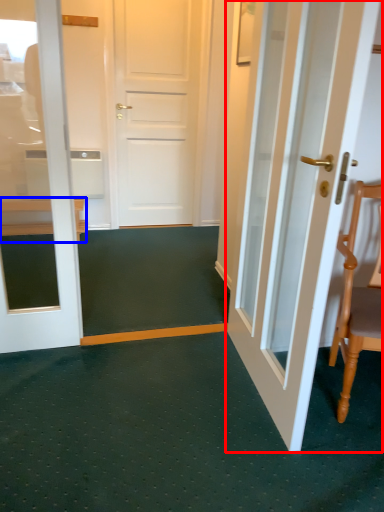
Question: Which object appears closest to the camera in this image, door (highlighted by a red box) or furniture (highlighted by a blue box)?

Choices:
 (A) door
 (B) furniture

Answer: (A)